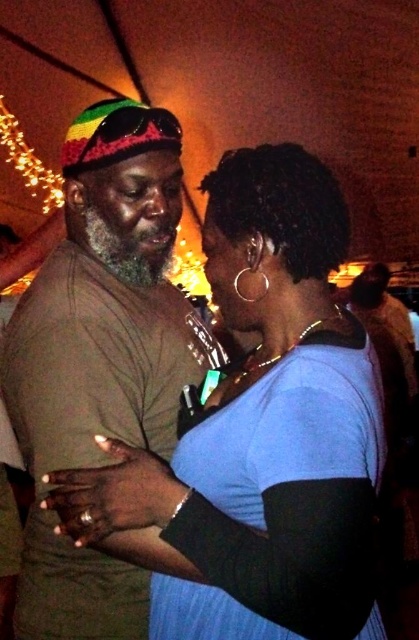
Question: Which point appears farthest from the camera in this image?

Choices:
 (A) (321, 244)
 (B) (108, 324)

Answer: (B)

Question: Which point is farther to the camera?

Choices:
 (A) blue matte shirt at center
 (B) brown matte t-shirt at left

Answer: (B)

Question: Can you confirm if blue matte shirt at center is bigger than brown matte t-shirt at left?

Choices:
 (A) no
 (B) yes

Answer: (A)

Question: Does blue matte shirt at center have a lesser width compared to brown matte t-shirt at left?

Choices:
 (A) yes
 (B) no

Answer: (B)

Question: Which point is closer to the camera?

Choices:
 (A) brown matte t-shirt at left
 (B) blue matte shirt at center

Answer: (B)

Question: Is blue matte shirt at center smaller than brown matte t-shirt at left?

Choices:
 (A) yes
 (B) no

Answer: (A)